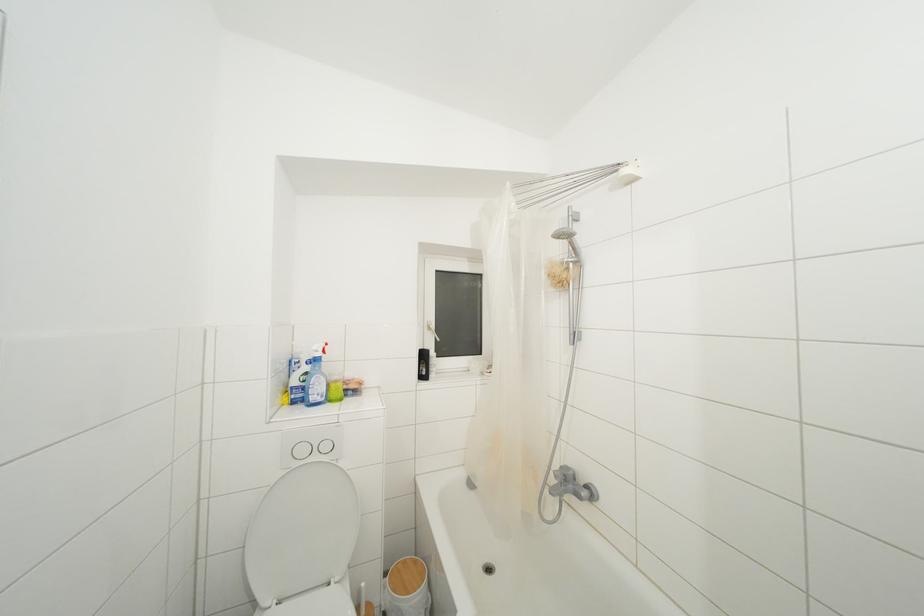
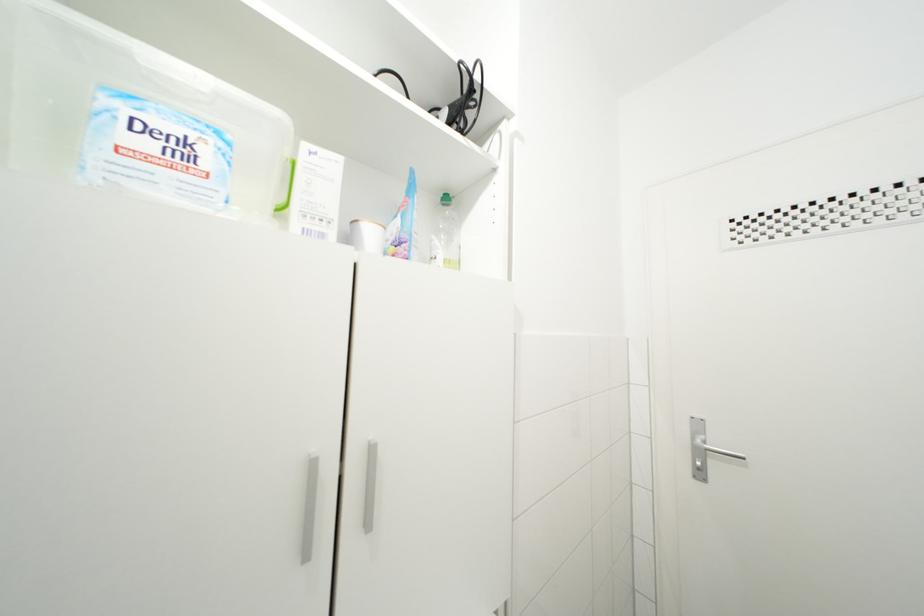
Question: Based on the continuous images, in which direction is the camera rotating? Reply with the corresponding letter.

Choices:
 (A) Left
 (B) Right
 (C) Up
 (D) Down

Answer: (B)